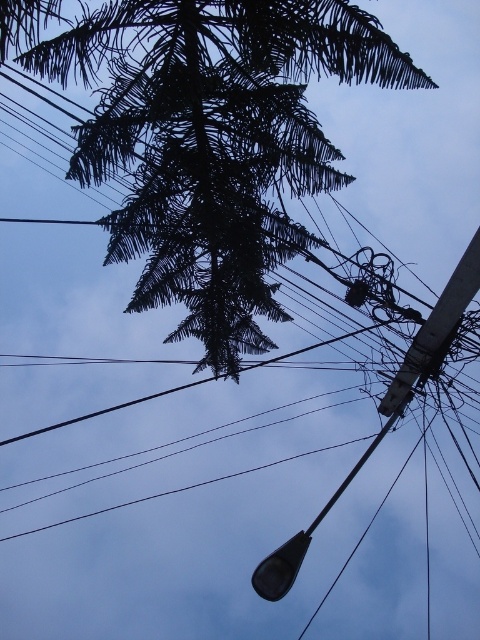
Looking at this image, you are standing at the point marked as point (207, 138) in the image. What object is located exactly at that point?

The dark green textured tree at upper center is located exactly at point (207, 138).

You are a city planner evaluating the space between the dark green textured tree at upper center and the matte gray streetlight at lower center. Based on their widths, can you determine if the tree is wider than the streetlight?

The dark green textured tree at upper center might be wider than the matte gray streetlight at lower center according to the description.